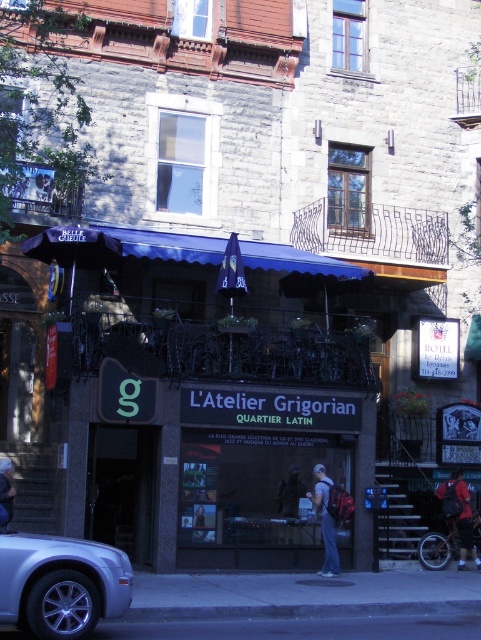
Question: Among these points, which one is farthest from the camera?

Choices:
 (A) (291, 465)
 (B) (468, 547)
 (C) (150, 276)

Answer: (C)

Question: Does matte black awning at center appear under silver metallic car at lower left?

Choices:
 (A) no
 (B) yes

Answer: (B)

Question: Is dark blue jacket at center further to the viewer compared to denim jacket at lower right?

Choices:
 (A) no
 (B) yes

Answer: (B)

Question: Is silver metallic car at lower left to the left of red backpack at lower right from the viewer's perspective?

Choices:
 (A) no
 (B) yes

Answer: (B)

Question: Among these points, which one is nearest to the camera?

Choices:
 (A) (51, 538)
 (B) (459, 522)
 (C) (294, 515)

Answer: (A)

Question: Which object is positioned farthest from the dark blue jacket at center?

Choices:
 (A) matte black awning at center
 (B) red backpack at lower right
 (C) denim jacket at lower right
 (D) denim pants at center

Answer: (C)